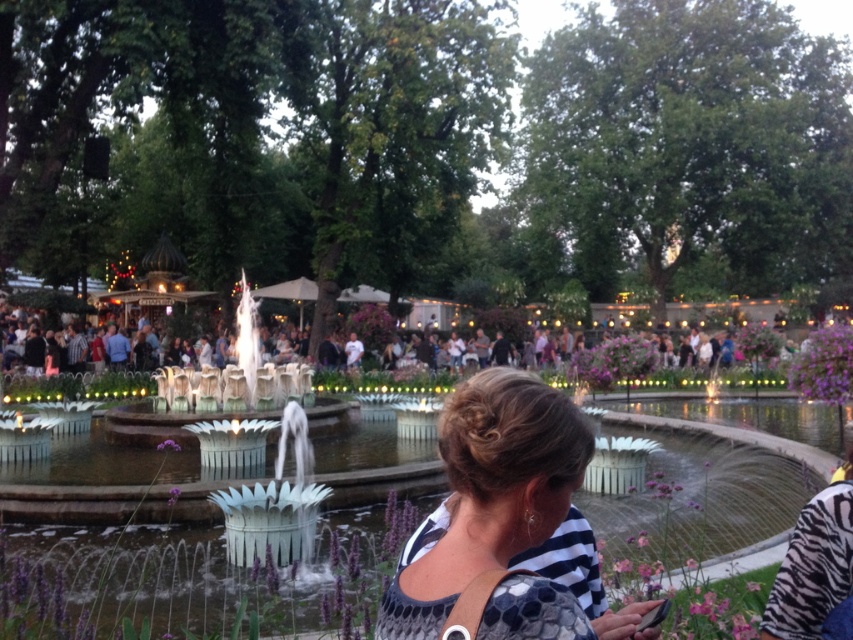
You are standing at the edge of the fountain pool in the park. There is a white dotted blouse at center located at point (508,520). If you want to walk directly towards the white dotted blouse at center, which direction should you head?

The white dotted blouse at center is located at point (508,520). Since the fountain is in the center of the frame, you should walk towards the center of the fountain to reach the white dotted blouse at center.

You are standing at the edge of the fountain pool in the park scene and notice both the white dotted blouse at center and the purple fabric flower at lower right. Which object is closer to you as you face the fountain?

The white dotted blouse at center is closer to you because it is in front of the purple fabric flower at lower right.